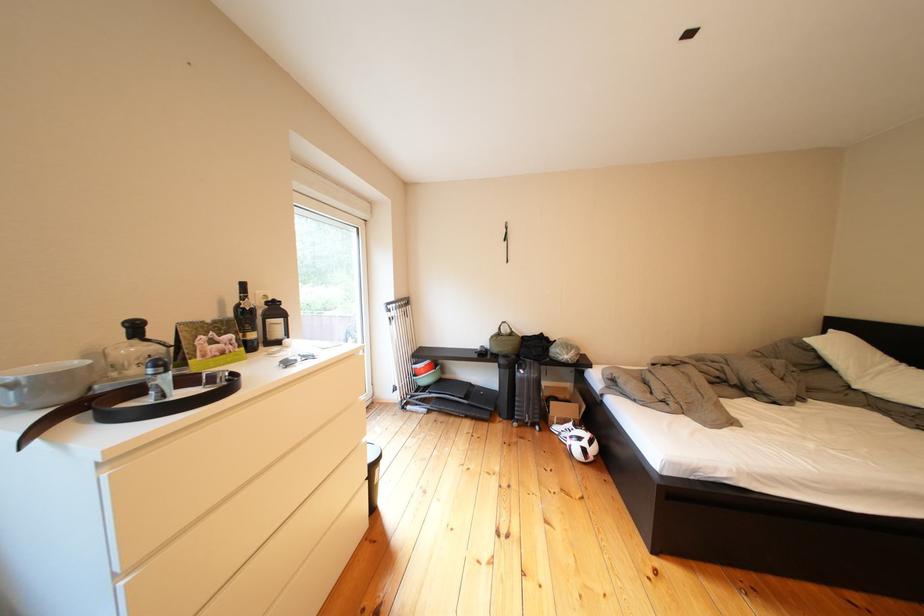
The height and width of the screenshot is (616, 924). What do you see at coordinates (132, 351) in the screenshot? I see `a dispenser pump head` at bounding box center [132, 351].